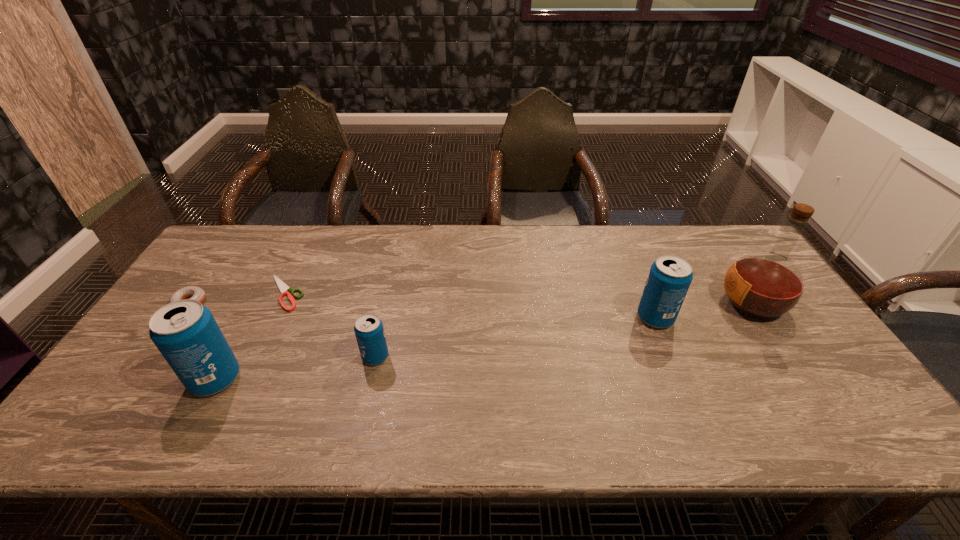
Where is `vacant space that satisfies the following two spatial constraints: 1. on the front side of the leftmost soda can; 2. on the right side of the leftmost object`? The height and width of the screenshot is (540, 960). vacant space that satisfies the following two spatial constraints: 1. on the front side of the leftmost soda can; 2. on the right side of the leftmost object is located at coordinates click(135, 379).